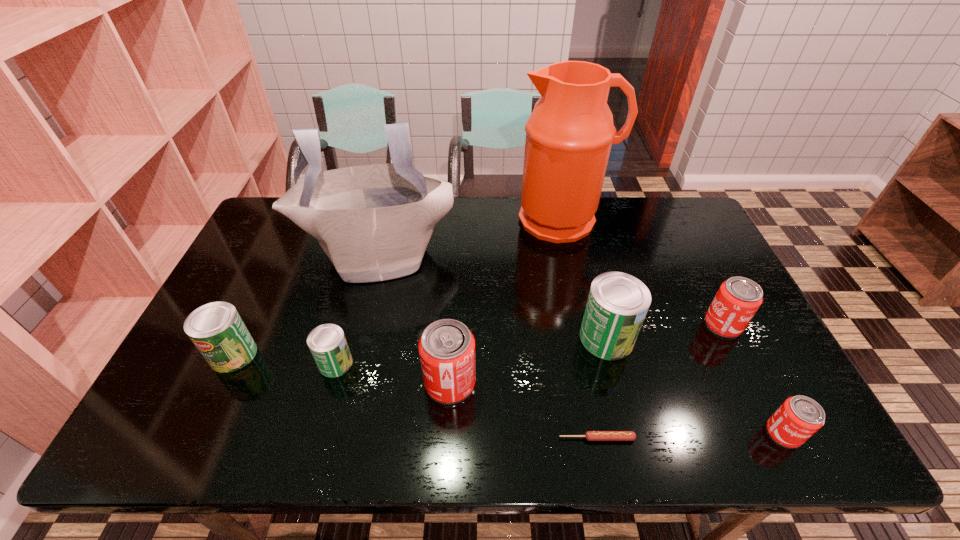
Image resolution: width=960 pixels, height=540 pixels. I want to click on vacant space located 0.140m on the front of the second biggest green can, so click(200, 426).

Image resolution: width=960 pixels, height=540 pixels. Find the location of `vacant space located on the back of the fifth can from right to left`. vacant space located on the back of the fifth can from right to left is located at coordinates click(x=348, y=314).

The width and height of the screenshot is (960, 540). I want to click on free location located on the left of the nearest red can, so click(x=629, y=433).

You are a GUI agent. You are given a task and a screenshot of the screen. Output one action in this format:
    pyautogui.click(x=<x>, y=<y>)
    Task: Click on the vacant space located on the left of the shortest object
    
    Given the screenshot: What is the action you would take?
    pyautogui.click(x=537, y=438)

Locate an element on the screen. This screenshot has height=540, width=960. water jug that is at the far edge is located at coordinates (569, 134).

In order to click on shopping bag that is at the far edge in this screenshot , I will do `click(374, 222)`.

In order to click on can that is positioned at the near edge in this screenshot , I will do `click(799, 417)`.

Locate an element on the screen. The image size is (960, 540). sausage present at the near edge is located at coordinates (589, 435).

I want to click on object located in the left edge section of the desktop, so click(x=216, y=329).

At what (x,y) coordinates should I click in order to perform the action: click on object located in the near right corner section of the desktop. Please return your answer as a coordinate pair (x, y). Looking at the image, I should click on (799, 417).